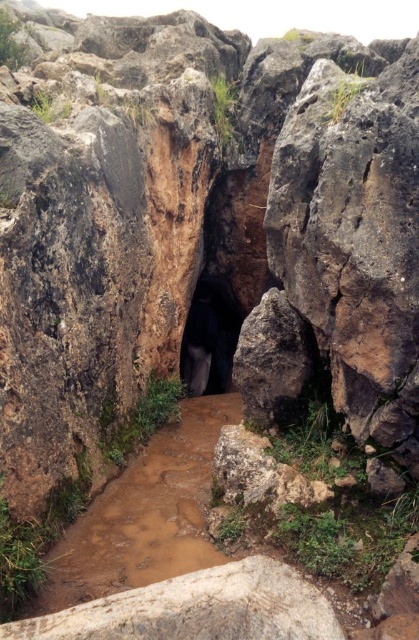
Question: Does brown muddy stream at center appear under black matte entrance at center?

Choices:
 (A) yes
 (B) no

Answer: (A)

Question: Can you confirm if brown muddy stream at center is positioned to the left of black matte entrance at center?

Choices:
 (A) yes
 (B) no

Answer: (A)

Question: Among these points, which one is farthest from the camera?

Choices:
 (A) (201, 380)
 (B) (113, 573)

Answer: (A)

Question: Can you confirm if brown muddy stream at center is positioned to the right of black matte entrance at center?

Choices:
 (A) no
 (B) yes

Answer: (A)